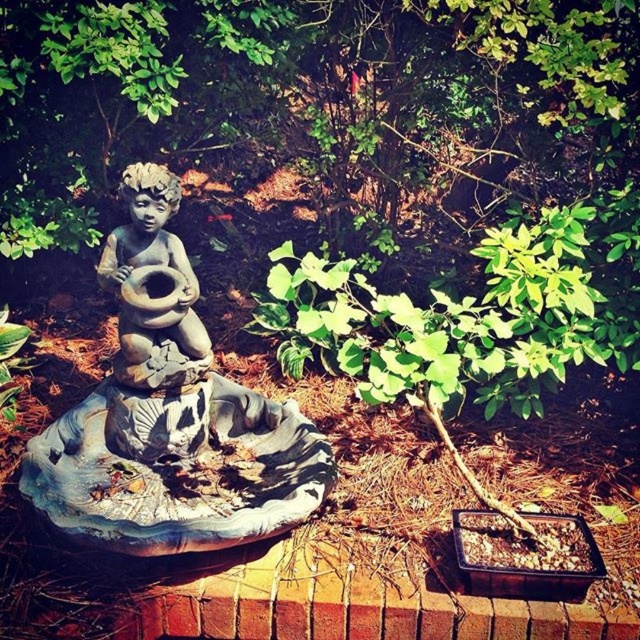
Question: Among these objects, which one is farthest from the camera?

Choices:
 (A) gray stone cherub at center
 (B) stone cherub at center

Answer: (B)

Question: Among these points, which one is nearest to the camera?

Choices:
 (A) (288, 420)
 (B) (147, 244)

Answer: (B)

Question: Is gray stone cherub at center below stone cherub at center?

Choices:
 (A) yes
 (B) no

Answer: (A)

Question: Is green leafy tree at upper center to the right of gray stone cherub at center from the viewer's perspective?

Choices:
 (A) no
 (B) yes

Answer: (B)

Question: Among these points, which one is farthest from the camera?

Choices:
 (A) (179, 330)
 (B) (429, 112)
 (C) (124, 353)

Answer: (B)

Question: Does gray stone cherub at center come behind stone cherub at center?

Choices:
 (A) no
 (B) yes

Answer: (A)